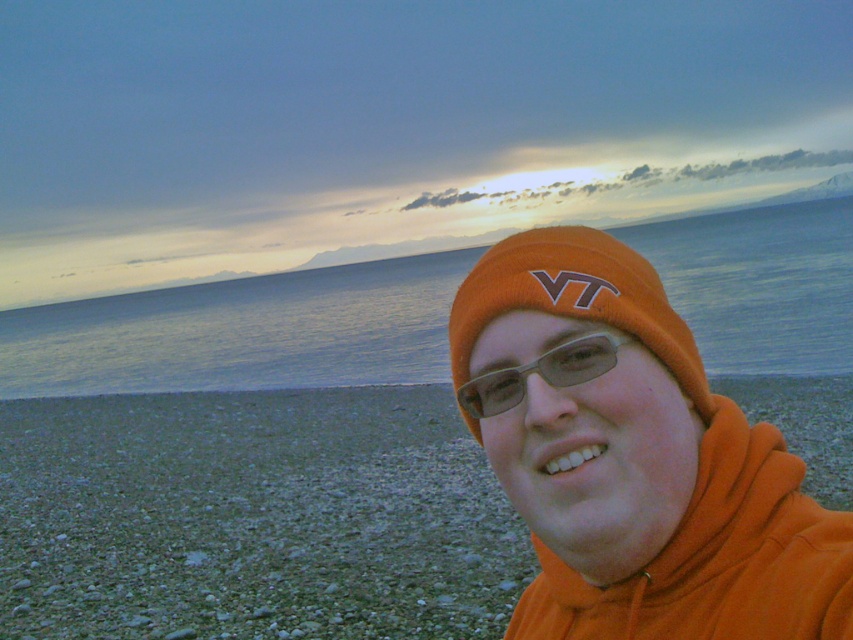
Is blue water at center positioned before transparent plastic glasses at center?

No, it is behind transparent plastic glasses at center.

Does blue water at center have a greater height compared to transparent plastic glasses at center?

Yes.

Is point (821, 208) less distant than point (509, 380)?

No, it is not.

The image size is (853, 640). I want to click on blue water at center, so click(x=242, y=333).

Which is behind, point (693, 472) or point (556, 371)?

Positioned behind is point (693, 472).

Can you confirm if orange fleece at center is positioned to the right of transparent plastic glasses at center?

Correct, you'll find orange fleece at center to the right of transparent plastic glasses at center.

Identify the location of orange fleece at center. The image size is (853, 640). (633, 458).

Is orange fabric at lower right to the left of orange knit beanie at center from the viewer's perspective?

Correct, you'll find orange fabric at lower right to the left of orange knit beanie at center.

Based on the photo, is orange fabric at lower right shorter than orange knit beanie at center?

In fact, orange fabric at lower right may be taller than orange knit beanie at center.

Is point (457, 540) positioned behind point (589, 291)?

Yes, it is behind point (589, 291).

I want to click on orange fabric at lower right, so click(x=253, y=516).